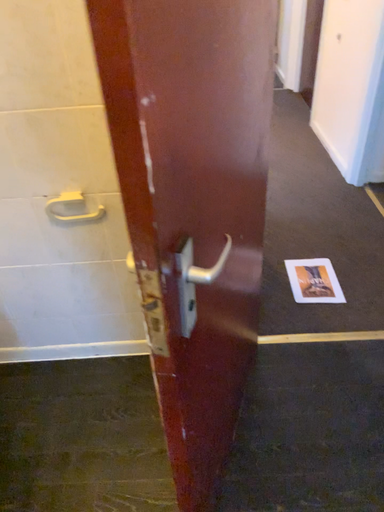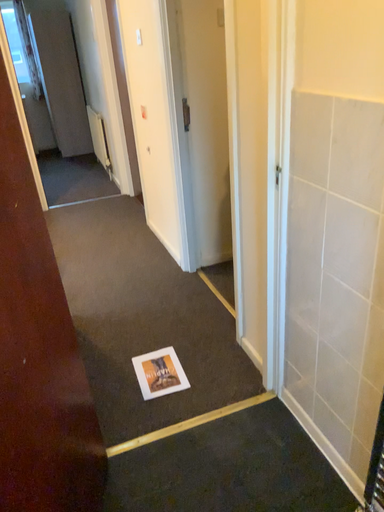
Question: How did the camera likely rotate when shooting the video?

Choices:
 (A) rotated downward
 (B) rotated upward

Answer: (B)